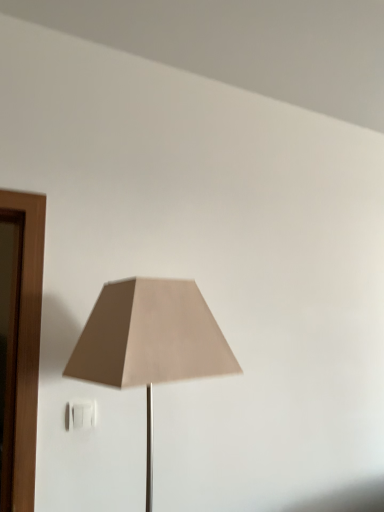
Question: Should I look upward or downward to see white plastic electric outlet at lower left?

Choices:
 (A) down
 (B) up

Answer: (A)

Question: Is beige fabric lampshade at center completely or partially outside of white plastic electric outlet at lower left?

Choices:
 (A) no
 (B) yes

Answer: (B)

Question: Considering the relative sizes of beige fabric lampshade at center and white plastic electric outlet at lower left in the image provided, is beige fabric lampshade at center thinner than white plastic electric outlet at lower left?

Choices:
 (A) no
 (B) yes

Answer: (A)

Question: From the image's perspective, does beige fabric lampshade at center appear higher than white plastic electric outlet at lower left?

Choices:
 (A) no
 (B) yes

Answer: (B)

Question: Is beige fabric lampshade at center facing away from white plastic electric outlet at lower left?

Choices:
 (A) no
 (B) yes

Answer: (B)

Question: Does beige fabric lampshade at center have a larger size compared to white plastic electric outlet at lower left?

Choices:
 (A) no
 (B) yes

Answer: (B)

Question: Is beige fabric lampshade at center smaller than white plastic electric outlet at lower left?

Choices:
 (A) no
 (B) yes

Answer: (A)

Question: Does white plastic electric outlet at lower left have a lesser width compared to beige fabric lampshade at center?

Choices:
 (A) no
 (B) yes

Answer: (B)

Question: Is white plastic electric outlet at lower left smaller than beige fabric lampshade at center?

Choices:
 (A) no
 (B) yes

Answer: (B)

Question: Does white plastic electric outlet at lower left appear on the left side of beige fabric lampshade at center?

Choices:
 (A) yes
 (B) no

Answer: (A)

Question: Is white plastic electric outlet at lower left positioned beyond the bounds of beige fabric lampshade at center?

Choices:
 (A) yes
 (B) no

Answer: (A)

Question: Does white plastic electric outlet at lower left have a greater width compared to beige fabric lampshade at center?

Choices:
 (A) yes
 (B) no

Answer: (B)

Question: Are white plastic electric outlet at lower left and beige fabric lampshade at center making contact?

Choices:
 (A) yes
 (B) no

Answer: (B)

Question: Looking at the image, does white plastic electric outlet at lower left seem bigger or smaller compared to beige fabric lampshade at center?

Choices:
 (A) big
 (B) small

Answer: (B)